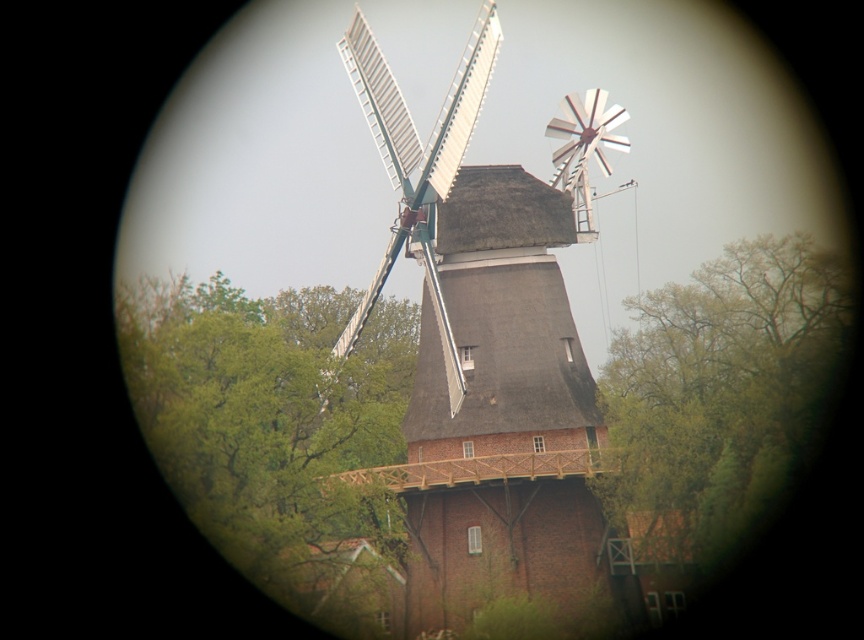
You are standing in front of the windmill and want to take a photo. There are two points marked in the image at coordinates point (550, 241) and point (347, 68). Which point will appear larger in your photo?

Point (550, 241) is closer to the camera than point (347, 68), so it will appear larger in the photo.

You are standing in a forest and see the brown wooden windmill at center. If you want to walk towards it, how many steps would you need to take if each step covers 2.5 feet?

The distance between you and the brown wooden windmill at center is 332.65 feet. Dividing this by 2.5 feet per step gives approximately 133 steps. Therefore, you would need to take around 133 steps to reach the brown wooden windmill at center.